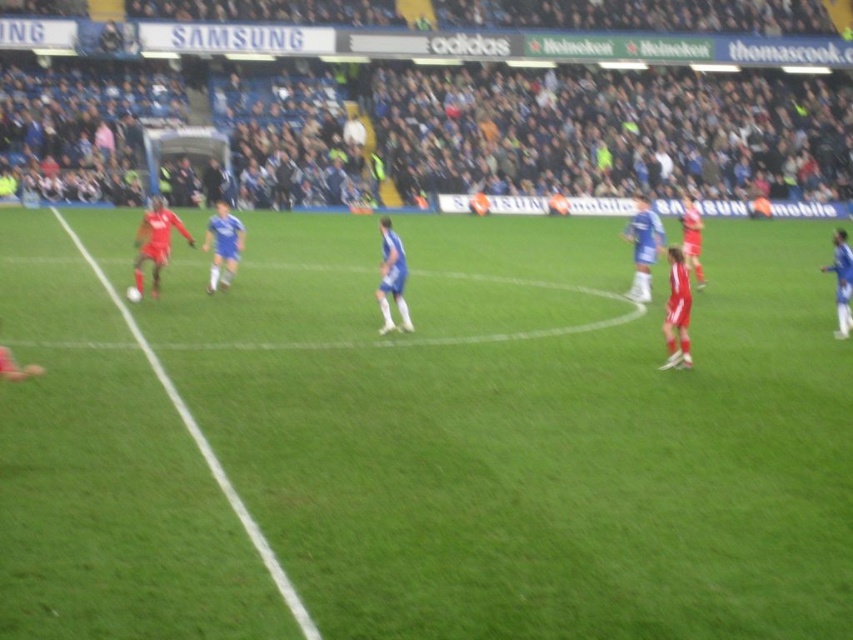
Is red jersey soccer player at left to the right of green grass at left from the viewer's perspective?

Correct, you'll find red jersey soccer player at left to the right of green grass at left.

Which is more to the left, red jersey soccer player at left or green grass at left?

green grass at left

Does point (587, 326) lie behind point (300, 620)?

Yes.

Where is `red jersey soccer player at left`? This screenshot has width=853, height=640. red jersey soccer player at left is located at coordinates (450, 336).

Does green grass field at center have a lesser height compared to blue jersey at center?

No.

Can you confirm if green grass field at center is smaller than blue jersey at center?

No.

Between point (339, 424) and point (392, 253), which one is positioned in front?

Point (339, 424) is in front.

At what (x,y) coordinates should I click in order to perform the action: click on green grass field at center. Please return your answer as a coordinate pair (x, y). This screenshot has width=853, height=640. Looking at the image, I should click on (421, 436).

Who is higher up, green grass field at center or red jersey soccer player at left?

green grass field at center is higher up.

Identify the location of green grass field at center. The image size is (853, 640). (421, 436).

This screenshot has width=853, height=640. What are the coordinates of `green grass field at center` in the screenshot? It's located at (421, 436).